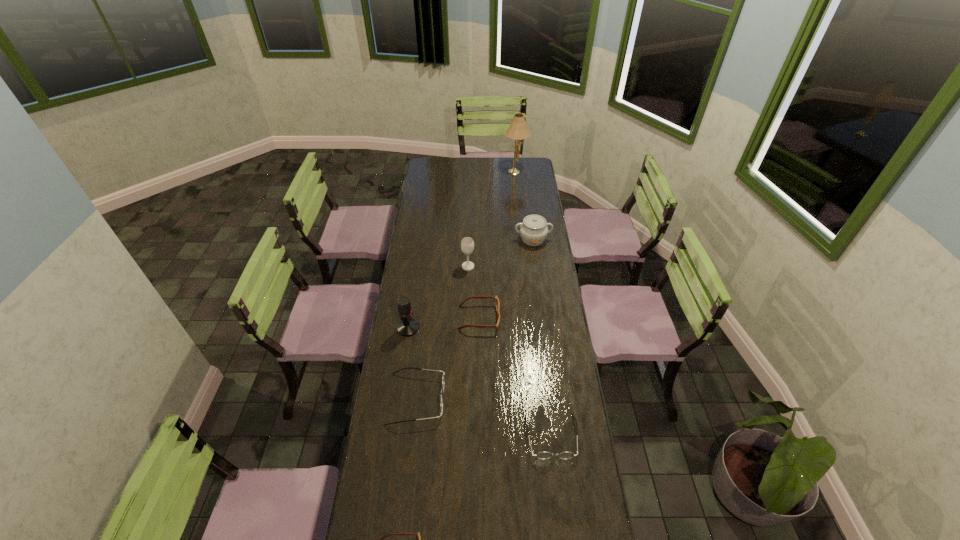
Find the location of a particular element. Image resolution: width=960 pixels, height=540 pixels. free spot between the bigger dark spectacles and the microphone is located at coordinates (413, 363).

You are a GUI agent. You are given a task and a screenshot of the screen. Output one action in this format:
    pyautogui.click(x=<x>, y=<y>)
    Task: Click on the empty location between the fourth shortest object and the second spectacles from right to left
    The width and height of the screenshot is (960, 540).
    Given the screenshot: What is the action you would take?
    pyautogui.click(x=447, y=358)

At what (x,y) coordinates should I click in order to perform the action: click on free area in between the microphone and the right dark spectacles. Please return your answer as a coordinate pair (x, y). Looking at the image, I should click on (480, 382).

Identify the location of empty space that is in between the rightmost spectacles and the lampshade. (534, 303).

Locate an element on the screen. free space that is in between the second spectacles from right to left and the sixth nearest object is located at coordinates (473, 292).

The width and height of the screenshot is (960, 540). In order to click on vacant area between the tallest spectacles and the red microphone in this screenshot , I will do `click(413, 363)`.

This screenshot has width=960, height=540. In order to click on free space between the third farthest object and the right dark spectacles in this screenshot , I will do `click(510, 352)`.

This screenshot has height=540, width=960. Find the location of `empty space between the tallest spectacles and the microphone`. empty space between the tallest spectacles and the microphone is located at coordinates (413, 363).

The image size is (960, 540). I want to click on object that is the third closest to the tallest object, so click(x=497, y=304).

What are the coordinates of `object that ranks as the seventh closest to the sixth nearest object` in the screenshot? It's located at (419, 538).